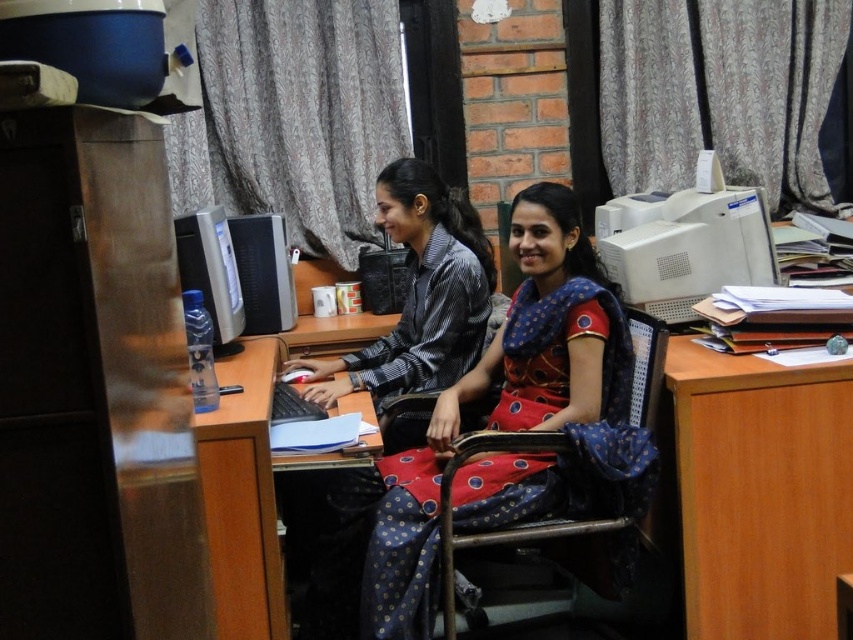
You are a delivery person who needs to place a package on the desk. The package is 20 cm wide. The coordinates of the desk surface are from point A at the bottom left corner at coordinates 0.0 to 0.0 to point B at the top right corner at coordinates 1.0 to 1.0. The red fabric saree at center is located at point C at coordinates 0.658, 0.606. Is there enough space on the desk to place the package without overlapping the saree?

The red fabric saree at center is located at coordinates (515, 420). Since the desk spans from (0, 0) to (852, 639), there is sufficient space around the saree to place a 20 cm package without overlapping it, provided the package is placed in an area not occupied by other objects.

You are standing 2 meters away from the desk in the office scene. You want to reach the point at coordinates point (521, 490) on the desk. Can you reach it without moving closer than 1.78 meters?

The distance of point (521, 490) from viewer is 1.78 meters. Since you are standing 2 meters away, you can reach it without moving closer than 1.78 meters because you can extend your arm to reach the point while maintaining the 2 meter distance.